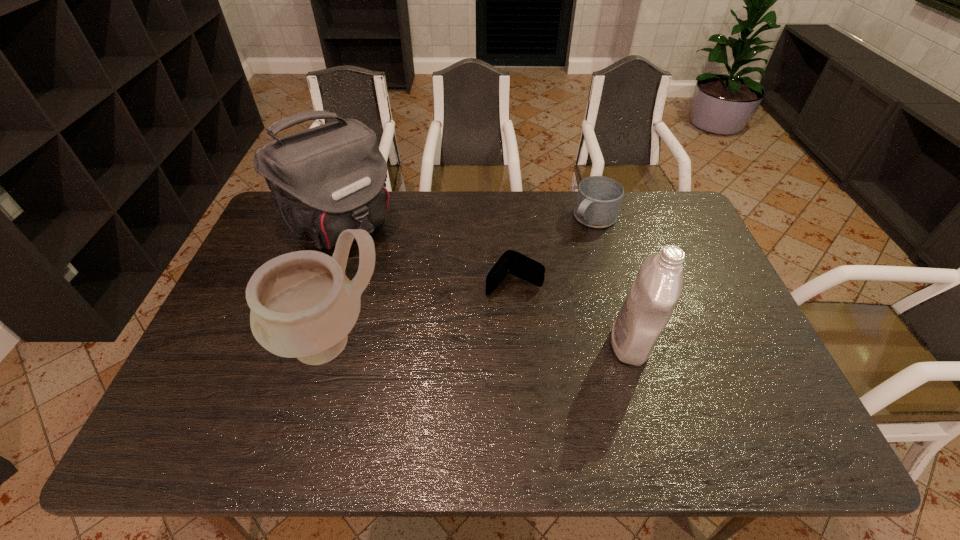
Identify the location of free point between the detergent and the third object from right to left. This screenshot has width=960, height=540. (572, 314).

At what (x,y) coordinates should I click in order to perform the action: click on vacant space in between the detergent and the mug. Please return your answer as a coordinate pair (x, y). Looking at the image, I should click on (612, 281).

Locate an element on the screen. This screenshot has width=960, height=540. free point between the detergent and the second shortest object is located at coordinates (612, 281).

Locate an element on the screen. object that can be found as the second closest to the pottery is located at coordinates (512, 262).

Locate an element on the screen. This screenshot has width=960, height=540. object that is the fourth closest to the third farthest object is located at coordinates (323, 180).

Locate an element on the screen. Image resolution: width=960 pixels, height=540 pixels. vacant point that satisfies the following two spatial constraints: 1. on the front side of the third object from left to right; 2. on the left side of the shoulder bag is located at coordinates (320, 285).

You are a GUI agent. You are given a task and a screenshot of the screen. Output one action in this format:
    pyautogui.click(x=<x>, y=<y>)
    Task: Click on the vacant space that satisfies the following two spatial constraints: 1. on the front side of the second shortest object; 2. on the right side of the detergent
    
    Given the screenshot: What is the action you would take?
    pyautogui.click(x=629, y=343)